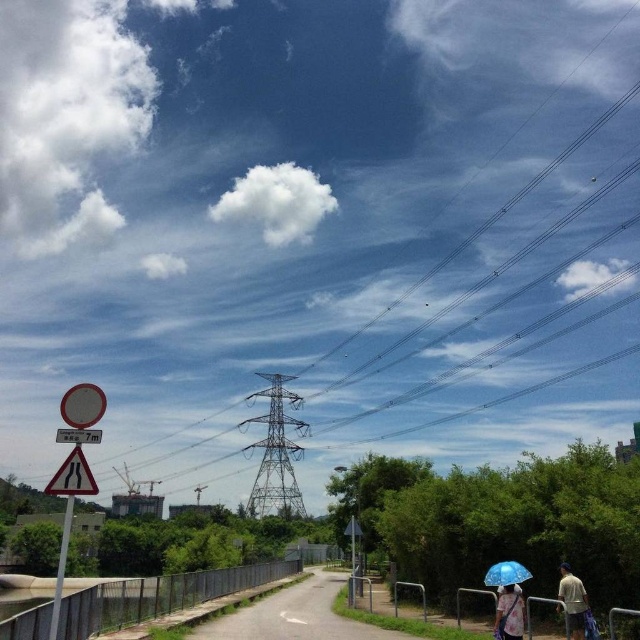
Can you confirm if smooth asphalt road at center is wider than blue fabric umbrella at lower right?

Yes.

Can you confirm if smooth asphalt road at center is bigger than blue fabric umbrella at lower right?

Yes.

Does point (244, 618) lie in front of point (508, 584)?

No, (244, 618) is further to viewer.

Locate an element on the screen. Image resolution: width=640 pixels, height=640 pixels. smooth asphalt road at center is located at coordinates (296, 616).

Between yellow reflective plastic road sign at lower left and light brown fabric shirt at lower right, which one appears on the left side from the viewer's perspective?

yellow reflective plastic road sign at lower left is more to the left.

Is yellow reflective plastic road sign at lower left to the left of light brown fabric shirt at lower right from the viewer's perspective?

Yes, yellow reflective plastic road sign at lower left is to the left of light brown fabric shirt at lower right.

Does point (88, 470) lie in front of point (579, 605)?

That is True.

Image resolution: width=640 pixels, height=640 pixels. Find the location of `yellow reflective plastic road sign at lower left`. yellow reflective plastic road sign at lower left is located at coordinates (72, 476).

Which is more to the right, smooth asphalt road at center or transparent blue umbrella at lower right?

Positioned to the right is transparent blue umbrella at lower right.

Which of these two, smooth asphalt road at center or transparent blue umbrella at lower right, stands taller?

smooth asphalt road at center is taller.

What do you see at coordinates (296, 616) in the screenshot? This screenshot has height=640, width=640. I see `smooth asphalt road at center` at bounding box center [296, 616].

This screenshot has height=640, width=640. I want to click on smooth asphalt road at center, so click(296, 616).